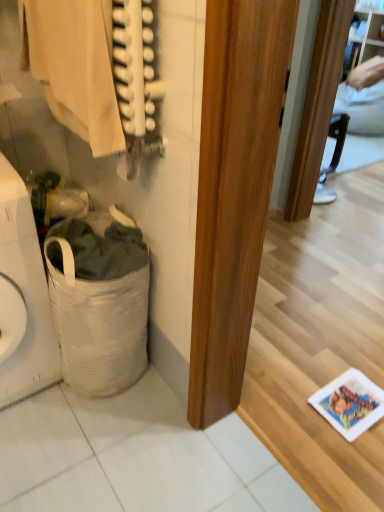
Question: Considering the relative positions of white woven laundry basket at lower left and light beige fabric at upper left in the image provided, is white woven laundry basket at lower left to the left or to the right of light beige fabric at upper left?

Choices:
 (A) right
 (B) left

Answer: (B)

Question: Do you think white woven laundry basket at lower left is within light beige fabric at upper left, or outside of it?

Choices:
 (A) inside
 (B) outside

Answer: (B)

Question: Estimate the real-world distances between objects in this image. Which object is closer to the light beige fabric at upper left?

Choices:
 (A) white woven laundry basket at lower left
 (B) white fabric laundry basket at lower left

Answer: (A)

Question: Which of these objects is positioned closest to the light beige fabric at upper left?

Choices:
 (A) white woven laundry basket at lower left
 (B) white fabric laundry basket at lower left

Answer: (A)